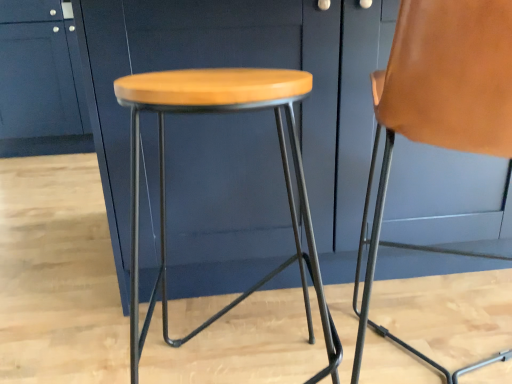
Question: Is wooden seat stool at center oriented away from brown leather chair at right?

Choices:
 (A) no
 (B) yes

Answer: (A)

Question: From a real-world perspective, is wooden seat stool at center physically below brown leather chair at right?

Choices:
 (A) no
 (B) yes

Answer: (B)

Question: Is wooden seat stool at center aimed at brown leather chair at right?

Choices:
 (A) no
 (B) yes

Answer: (A)

Question: Is wooden seat stool at center to the left of brown leather chair at right from the viewer's perspective?

Choices:
 (A) yes
 (B) no

Answer: (A)

Question: Is wooden seat stool at center located outside brown leather chair at right?

Choices:
 (A) no
 (B) yes

Answer: (B)

Question: Is matte blue cabinet at upper left, which is the 2th cabinetry in right-to-left order, bigger or smaller than brown leather chair at right?

Choices:
 (A) small
 (B) big

Answer: (B)

Question: Is matte blue cabinet at upper left, positioned as the first cabinetry in back-to-front order, in front of or behind brown leather chair at right in the image?

Choices:
 (A) front
 (B) behind

Answer: (B)

Question: From a real-world perspective, is matte blue cabinet at upper left, the first cabinetry when ordered from left to right, above or below brown leather chair at right?

Choices:
 (A) above
 (B) below

Answer: (A)

Question: Considering the positions of point (7, 72) and point (385, 76), is point (7, 72) closer or farther from the camera than point (385, 76)?

Choices:
 (A) closer
 (B) farther

Answer: (B)

Question: From a real-world perspective, is brown leather chair at right physically located above or below matte blue cabinet at center, arranged as the first cabinetry when viewed from the right?

Choices:
 (A) below
 (B) above

Answer: (A)

Question: Considering the relative positions of brown leather chair at right and matte blue cabinet at center, the first cabinetry when ordered from front to back, in the image provided, is brown leather chair at right to the left or to the right of matte blue cabinet at center, the first cabinetry when ordered from front to back,?

Choices:
 (A) right
 (B) left

Answer: (B)

Question: From the image's perspective, is brown leather chair at right above or below matte blue cabinet at center, arranged as the first cabinetry when viewed from the right?

Choices:
 (A) below
 (B) above

Answer: (A)

Question: Considering their positions, is brown leather chair at right located in front of or behind matte blue cabinet at center, arranged as the first cabinetry when viewed from the right?

Choices:
 (A) behind
 (B) front

Answer: (B)

Question: Is point (155, 117) closer or farther from the camera than point (55, 132)?

Choices:
 (A) closer
 (B) farther

Answer: (A)

Question: Is matte blue cabinet at center, the first cabinetry when ordered from front to back, situated inside matte blue cabinet at upper left, which is the 2th cabinetry in right-to-left order, or outside?

Choices:
 (A) inside
 (B) outside

Answer: (B)